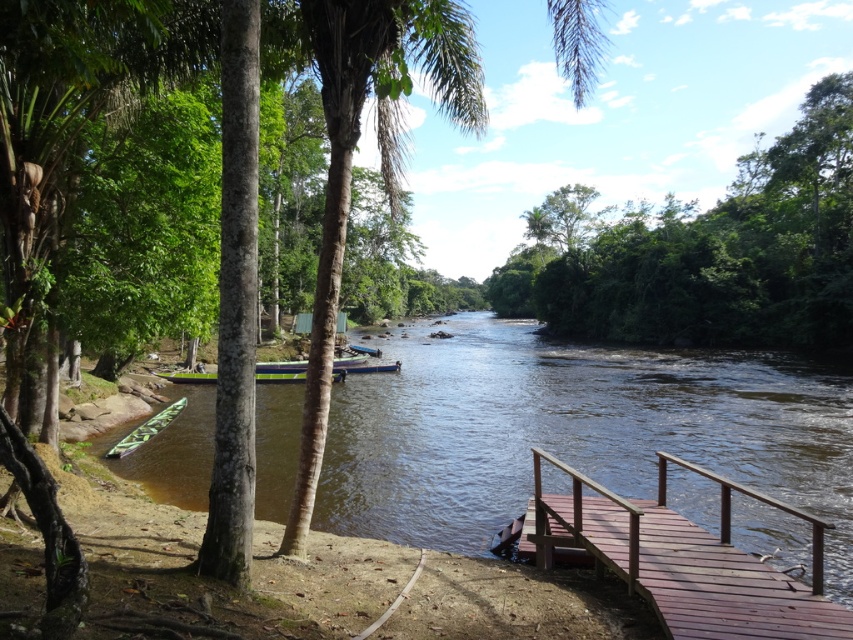
Question: Which object is farther from the camera taking this photo?

Choices:
 (A) green plastic boat at lower left
 (B) brown wooden dock at lower right
 (C) brown smooth river at center

Answer: (A)

Question: Does brown smooth river at center appear under green plastic boat at lower left?

Choices:
 (A) no
 (B) yes

Answer: (A)

Question: Among these objects, which one is farthest from the camera?

Choices:
 (A) green leafy tree at upper center
 (B) green plastic boat at lower left

Answer: (A)

Question: Is brown smooth river at center thinner than green plastic boat at lower left?

Choices:
 (A) no
 (B) yes

Answer: (A)

Question: Which point is farther to the camera?

Choices:
 (A) (108, 452)
 (B) (808, 317)

Answer: (B)

Question: Can you confirm if brown smooth river at center is positioned to the left of green plastic boat at lower left?

Choices:
 (A) yes
 (B) no

Answer: (B)